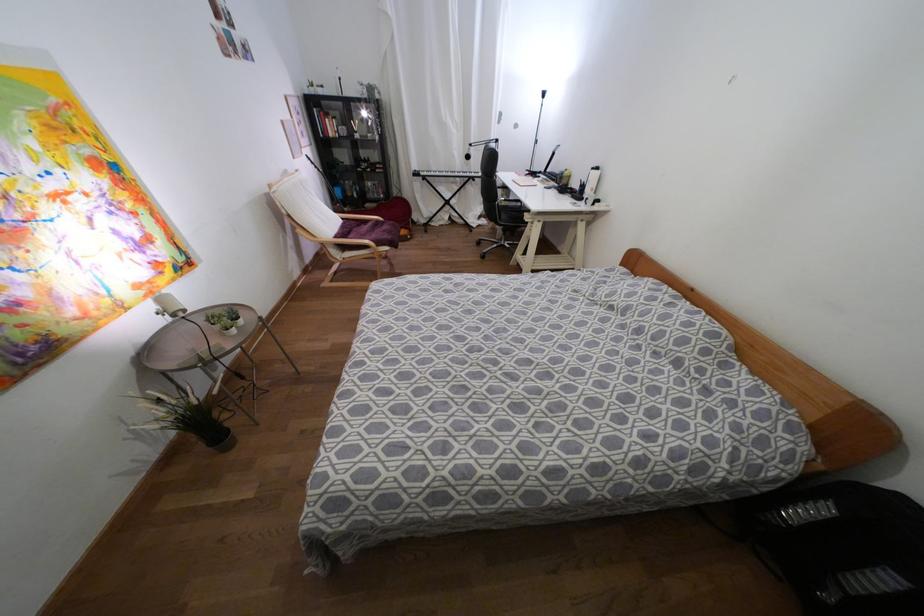
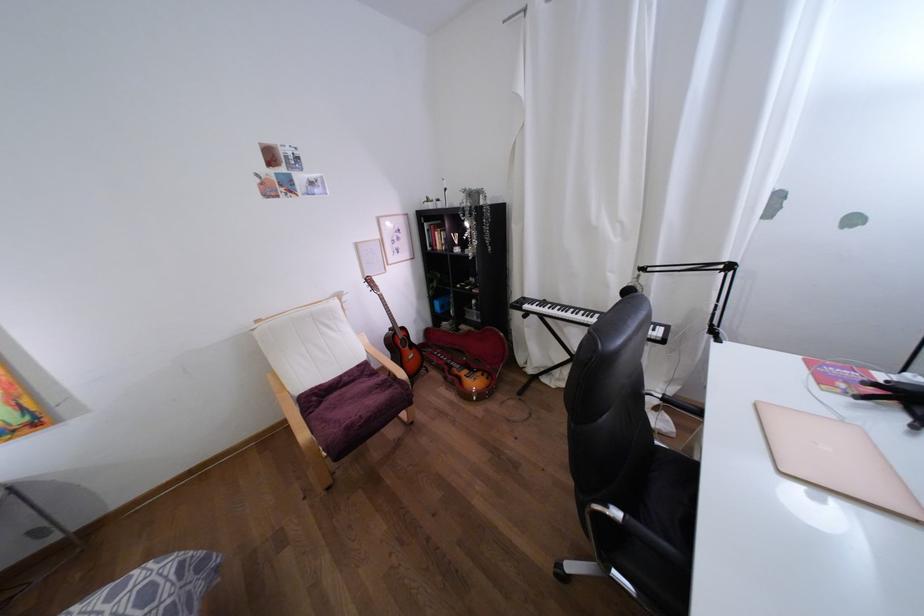
Where in the second image is the point corresponding to point 420,172 from the first image?

(525, 306)